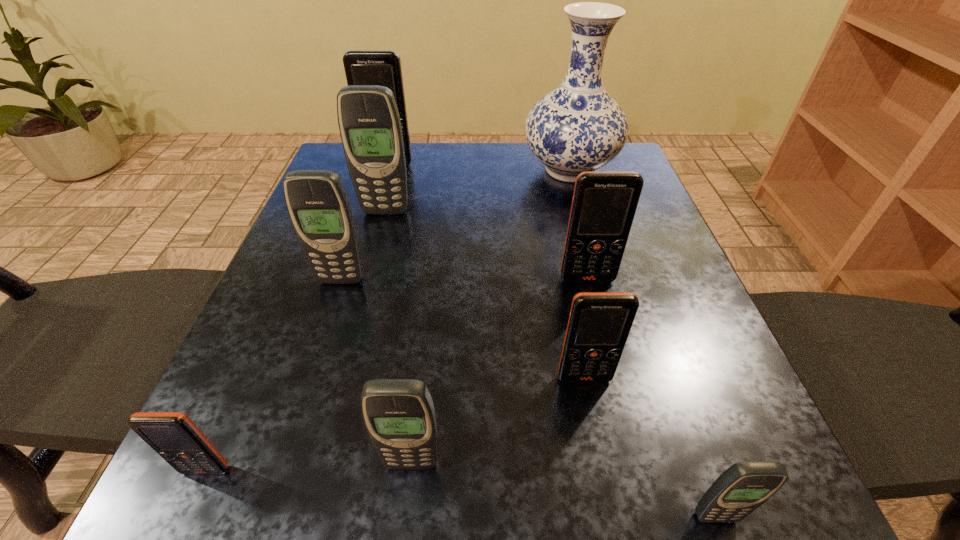
Identify the location of gray cellular telephone that is the third closest to the sixth farthest object. (318, 205).